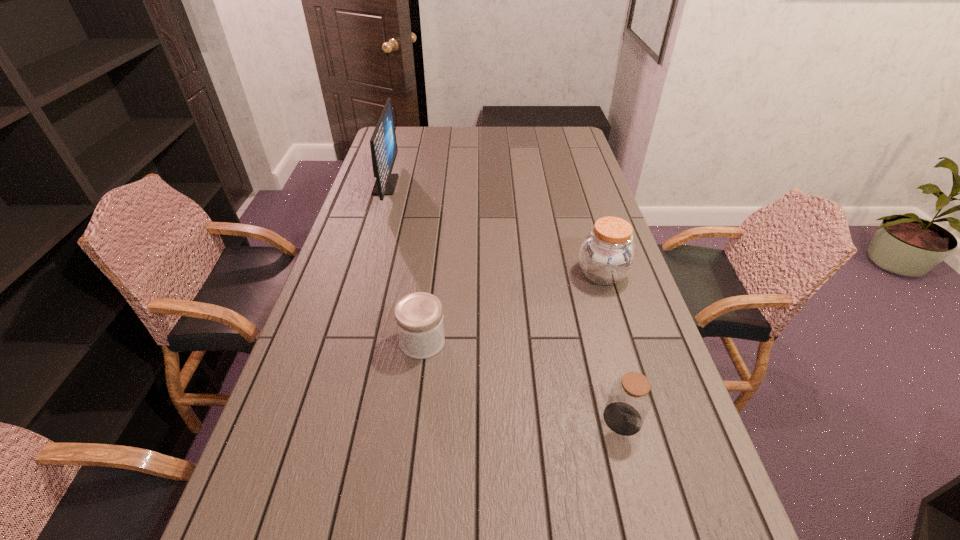
At what (x,y) coordinates should I click in order to perform the action: click on free space between the computer monitor and the third shortest object. Please return your answer as a coordinate pair (x, y). Looking at the image, I should click on (494, 230).

I want to click on vacant region between the second tallest object and the third object from right to left, so click(513, 308).

You are a GUI agent. You are given a task and a screenshot of the screen. Output one action in this format:
    pyautogui.click(x=<x>, y=<y>)
    Task: Click on the vacant region between the second object from left to right and the nearest jar
    The width and height of the screenshot is (960, 540).
    Given the screenshot: What is the action you would take?
    pyautogui.click(x=522, y=380)

Image resolution: width=960 pixels, height=540 pixels. Find the location of `vacant area between the nearest jar and the second nearest jar`. vacant area between the nearest jar and the second nearest jar is located at coordinates (522, 380).

This screenshot has width=960, height=540. Identify the location of unoccupied position between the third object from right to left and the second tallest object. (513, 308).

Find the location of a particular element. unoccupied position between the farthest jar and the third farthest object is located at coordinates (513, 308).

Locate which object ranks second in proximity to the computer monitor. Please provide its 2D coordinates. Your answer should be formatted as a tuple, i.e. [(x, y)], where the tuple contains the x and y coordinates of a point satisfying the conditions above.

[(607, 254)]

The image size is (960, 540). In order to click on object that stands as the third closest to the third nearest object in this screenshot , I will do `click(383, 144)`.

Choose which jar is the second nearest neighbor to the tallest jar. Please provide its 2D coordinates. Your answer should be formatted as a tuple, i.e. [(x, y)], where the tuple contains the x and y coordinates of a point satisfying the conditions above.

[(419, 319)]

Locate an element on the screen. This screenshot has height=540, width=960. jar object that ranks as the closest to the nearest object is located at coordinates (607, 254).